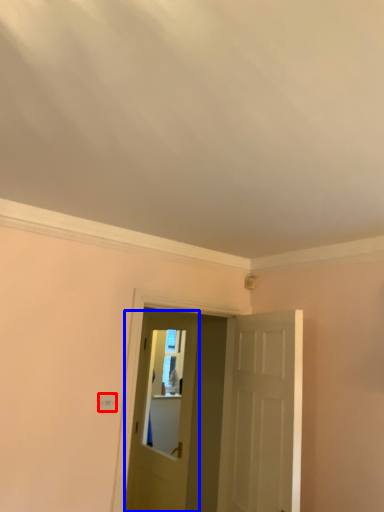
Question: Among these objects, which one is farthest to the camera, light switch (highlighted by a red box) or door (highlighted by a blue box)?

Choices:
 (A) light switch
 (B) door

Answer: (B)